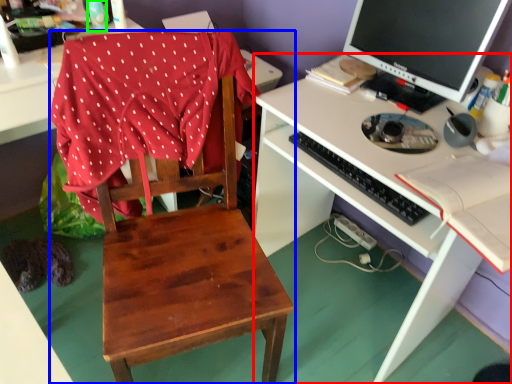
Question: Considering the real-world distances, which object is closest to desk (highlighted by a red box)? chair (highlighted by a blue box) or bottle (highlighted by a green box).

Choices:
 (A) chair
 (B) bottle

Answer: (A)